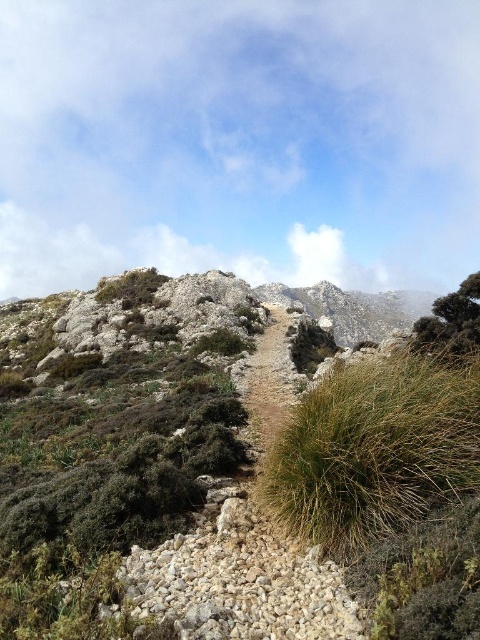
Question: Does green fibrous grass at center have a lesser width compared to green leafy bush at upper right?

Choices:
 (A) no
 (B) yes

Answer: (B)

Question: Which of the following is the farthest from the observer?

Choices:
 (A) green leafy bush at upper right
 (B) green fibrous grass at center

Answer: (A)

Question: Which point is farther from the camera taking this photo?

Choices:
 (A) (443, 332)
 (B) (405, 385)

Answer: (A)

Question: Is green fibrous grass at center positioned behind green leafy bush at upper right?

Choices:
 (A) yes
 (B) no

Answer: (B)

Question: Does green fibrous grass at center have a greater width compared to green leafy bush at upper right?

Choices:
 (A) no
 (B) yes

Answer: (A)

Question: Which object is closer to the camera taking this photo?

Choices:
 (A) green fibrous grass at center
 (B) green leafy bush at upper right

Answer: (A)